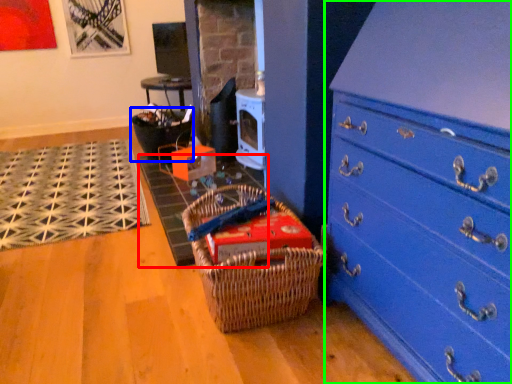
Question: Based on their relative distances, which object is farther from doormat (highlighted by a red box)? Choose from basket (highlighted by a blue box) and chest of drawers (highlighted by a green box).

Choices:
 (A) basket
 (B) chest of drawers

Answer: (B)